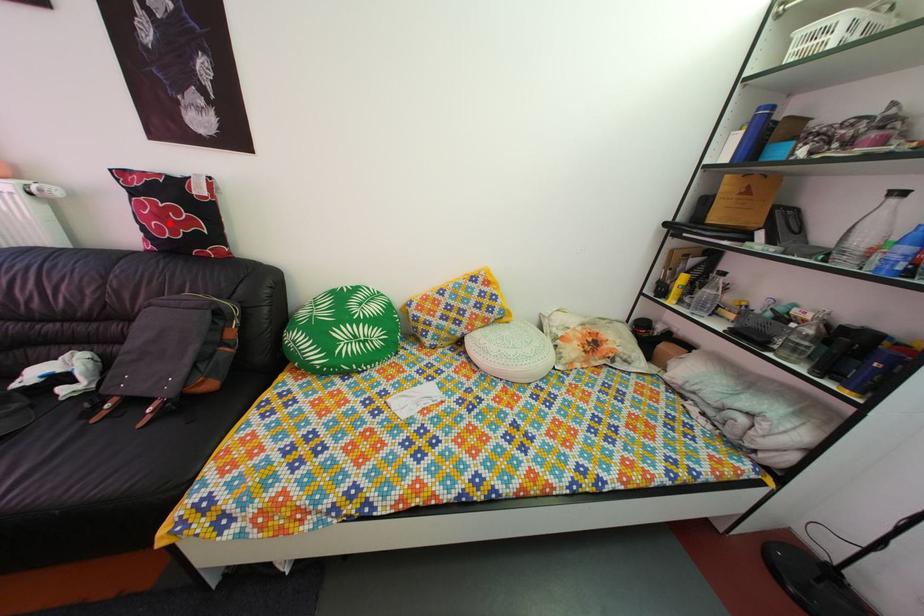
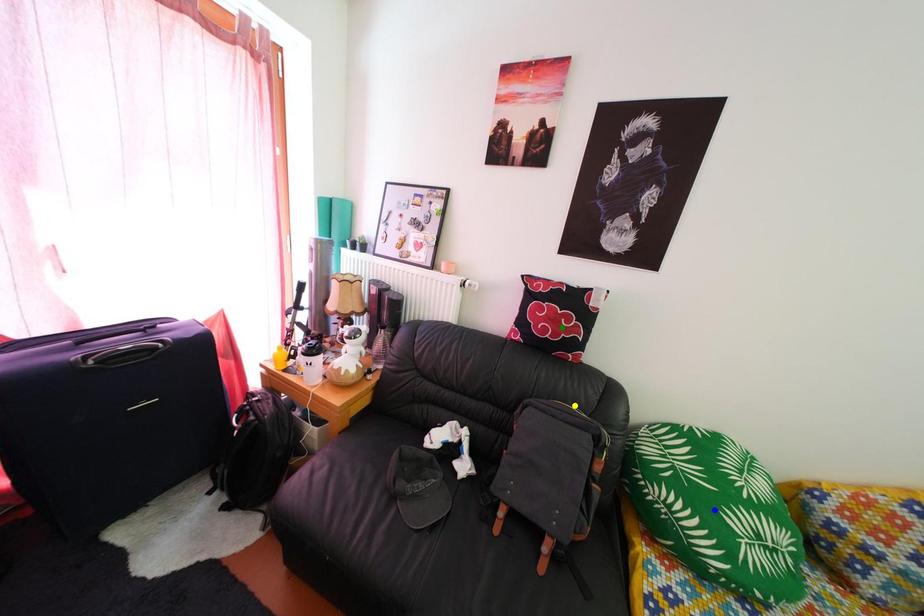
Question: I am providing you with two images of the same scene from different viewpoints. A red point is marked on the first image. You are given multiple points on the second image. Which point in image 2 represents the same 3d spot as the red point in image 1?

Choices:
 (A) yellow point
 (B) green point
 (C) blue point

Answer: (B)